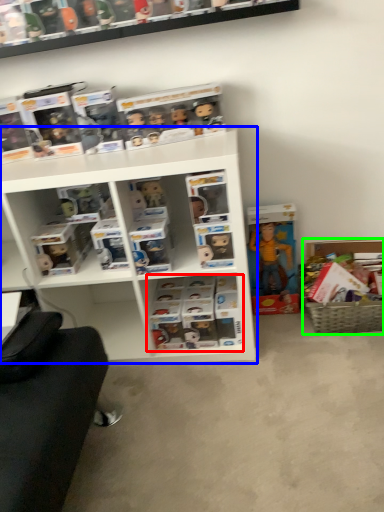
Question: Estimate the real-world distances between objects in this image. Which object is farther from book (highlighted by a red box), shelf (highlighted by a blue box) or cabinet (highlighted by a green box)?

Choices:
 (A) shelf
 (B) cabinet

Answer: (B)